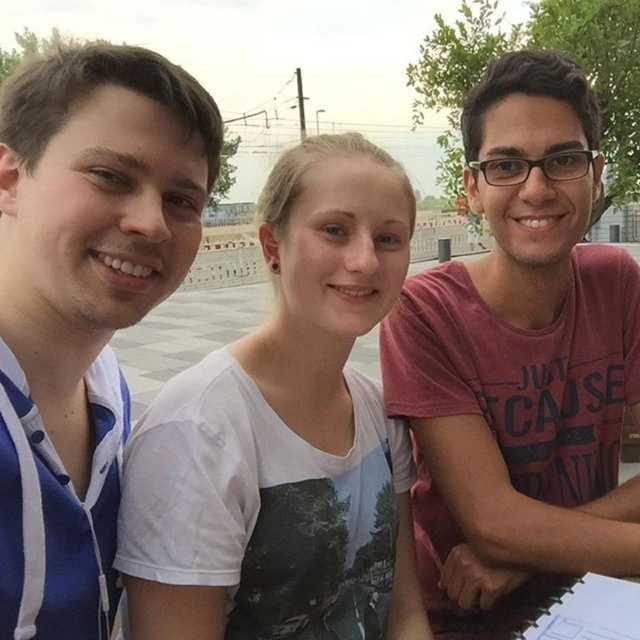
Question: Where is white cotton t-shirt at center located in relation to blue striped shirt at left in the image?

Choices:
 (A) below
 (B) above

Answer: (A)

Question: Which of the following is the closest to the observer?

Choices:
 (A) (35, 554)
 (B) (145, 444)
 (C) (468, 532)

Answer: (A)

Question: Is white cotton t-shirt at center below blue striped shirt at left?

Choices:
 (A) yes
 (B) no

Answer: (A)

Question: Among these points, which one is farthest from the camera?

Choices:
 (A) (90, 61)
 (B) (566, 380)

Answer: (B)

Question: Does pink cotton shirt at right come in front of blue striped shirt at left?

Choices:
 (A) yes
 (B) no

Answer: (B)

Question: Which of the following is the farthest from the observer?

Choices:
 (A) blue striped shirt at left
 (B) white cotton t-shirt at center

Answer: (B)